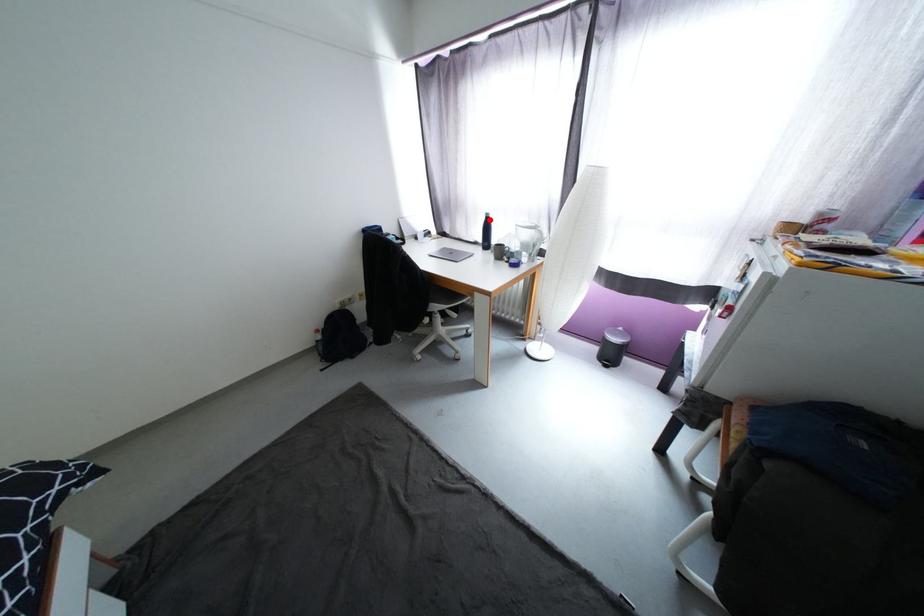
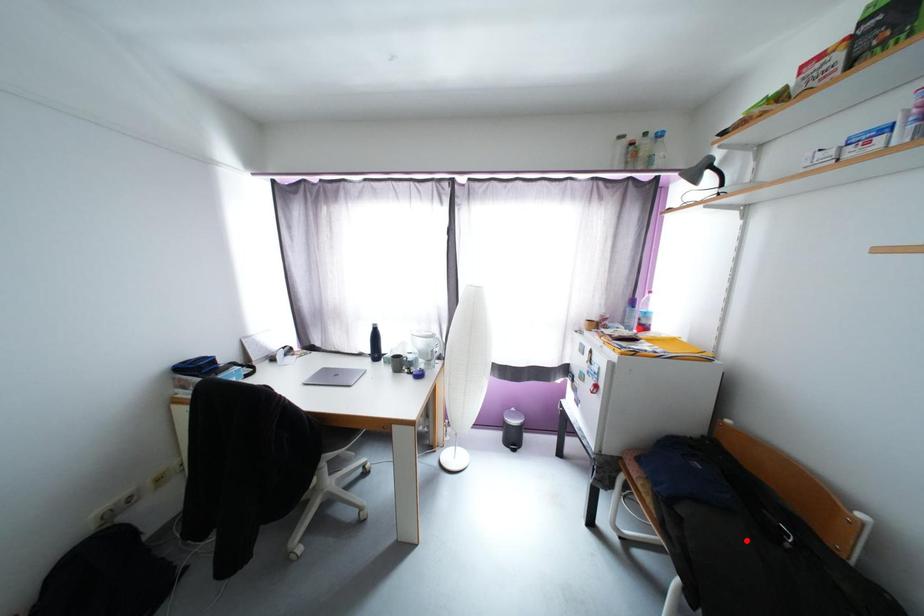
I am providing you with two images of the same scene from different viewpoints. A red point is marked on the first image and another point is marked on the second image. Is the red point in image1 aligned with the point shown in image2?

No